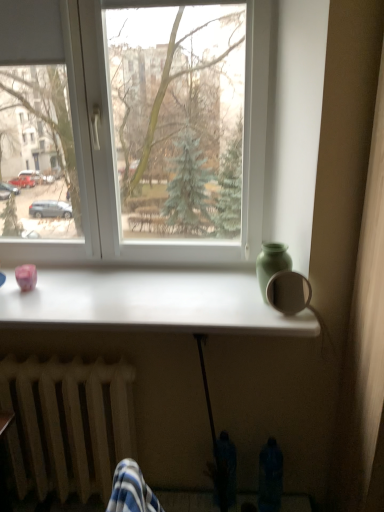
This screenshot has width=384, height=512. Find the location of `vacant space situated on the left part of green matte vase at upper right`. vacant space situated on the left part of green matte vase at upper right is located at coordinates (223, 304).